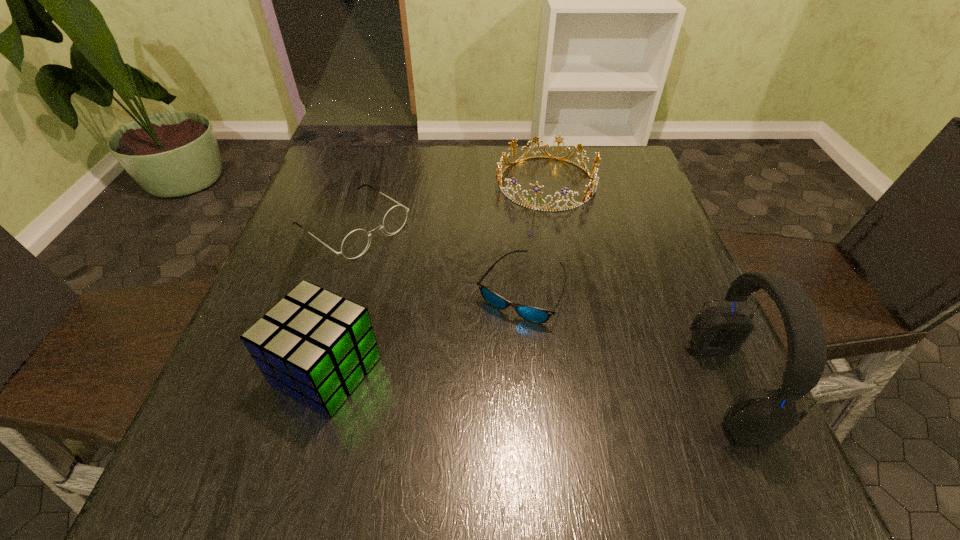
This screenshot has height=540, width=960. In order to click on vacant space that is in between the tallest object and the shortest object in this screenshot , I will do `click(624, 339)`.

You are a GUI agent. You are given a task and a screenshot of the screen. Output one action in this format:
    pyautogui.click(x=<x>, y=<y>)
    Task: Click on the vacant region between the rightmost object and the fourth tallest object
    This screenshot has width=960, height=540.
    Given the screenshot: What is the action you would take?
    pyautogui.click(x=540, y=307)

Find the location of `free space between the second tallest object and the headset`. free space between the second tallest object and the headset is located at coordinates (527, 379).

Find the location of a particular element. This screenshot has height=540, width=960. vacant space in between the shortest object and the tiara is located at coordinates (534, 237).

Where is `free spot between the spectacles and the tallest object`? free spot between the spectacles and the tallest object is located at coordinates (540, 307).

Image resolution: width=960 pixels, height=540 pixels. Identify the location of free space between the spectacles and the tiara. (449, 205).

The height and width of the screenshot is (540, 960). I want to click on the second closest object to the spectacles, so click(x=316, y=346).

Point out which object is positioned as the third nearest to the fourth shortest object. Please provide its 2D coordinates. Your answer should be formatted as a tuple, i.e. [(x, y)], where the tuple contains the x and y coordinates of a point satisfying the conditions above.

[(594, 180)]

What are the coordinates of `vacant region that satisfies the following two spatial constraints: 1. on the front side of the tallest object; 2. on the headband of the third shortest object` in the screenshot? It's located at (584, 387).

The image size is (960, 540). Find the location of `vacant space that satisfies the following two spatial constraints: 1. on the front side of the fourth shortest object; 2. on the headband of the headset`. vacant space that satisfies the following two spatial constraints: 1. on the front side of the fourth shortest object; 2. on the headband of the headset is located at coordinates (322, 387).